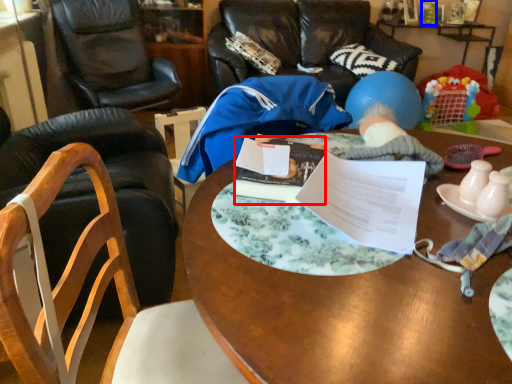
Question: Which point is closer to the camera, book (highlighted by a red box) or bottle (highlighted by a blue box)?

Choices:
 (A) book
 (B) bottle

Answer: (A)